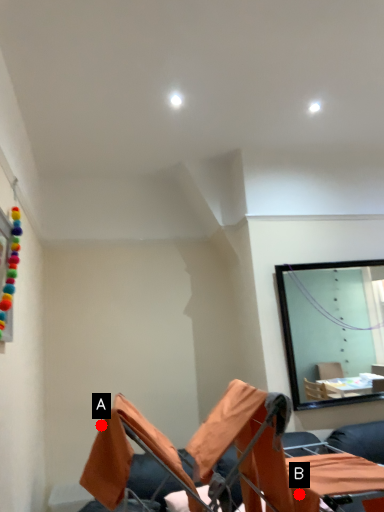
Question: Two points are circled on the image, labeled by A and B beside each circle. Which point is closer to the camera?

Choices:
 (A) A is closer
 (B) B is closer

Answer: (B)